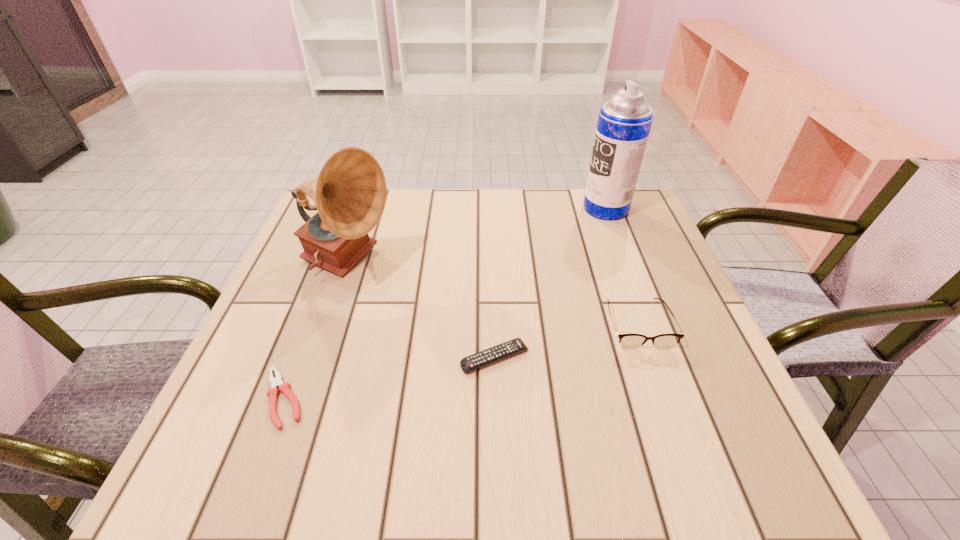
The image size is (960, 540). In order to click on free space between the shortest object and the phonograph record in this screenshot , I will do `click(316, 332)`.

Image resolution: width=960 pixels, height=540 pixels. Find the location of `empty space that is in between the third tallest object and the remote control`. empty space that is in between the third tallest object and the remote control is located at coordinates (566, 341).

Find the location of a particular element. The image size is (960, 540). vacant area that lies between the aerosol can and the spectacles is located at coordinates (621, 266).

Image resolution: width=960 pixels, height=540 pixels. In order to click on vacant area between the third shortest object and the farthest object in this screenshot , I will do `click(621, 266)`.

This screenshot has height=540, width=960. Identify the location of vacant space that's between the aerosol can and the shortest object. (444, 303).

This screenshot has width=960, height=540. I want to click on free area in between the third object from right to left and the third tallest object, so click(x=566, y=341).

I want to click on the third closest object to the pliers, so click(627, 341).

Identify the location of the closest object relative to the spectacles. (491, 355).

Identify the location of vacant space that satisfies the following two spatial constraints: 1. on the label side of the aerosol can; 2. on the face of the spectacles. The width and height of the screenshot is (960, 540). (650, 325).

Locate an element on the screen. Image resolution: width=960 pixels, height=540 pixels. vacant position in the image that satisfies the following two spatial constraints: 1. on the horn of the phonograph record; 2. on the right side of the remote control is located at coordinates (316, 357).